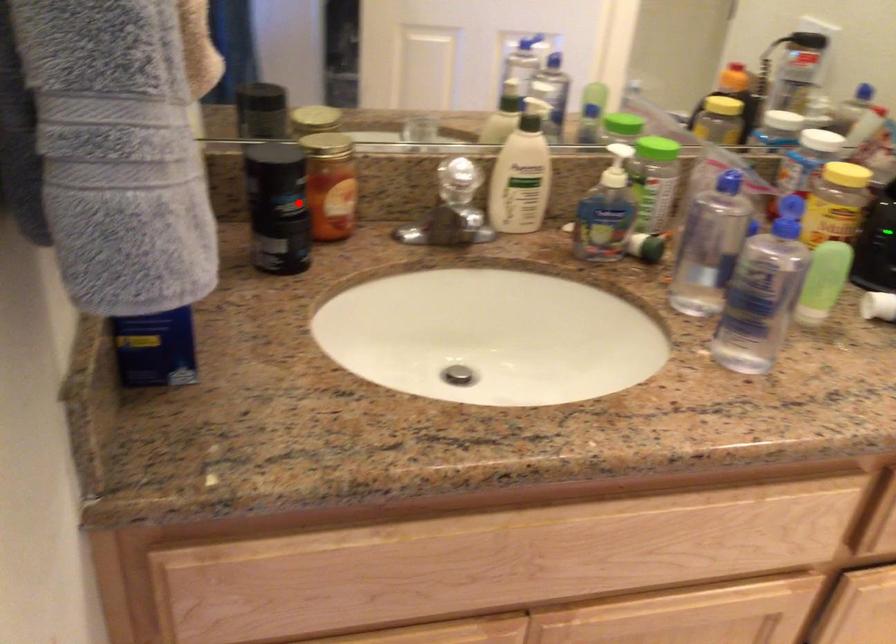
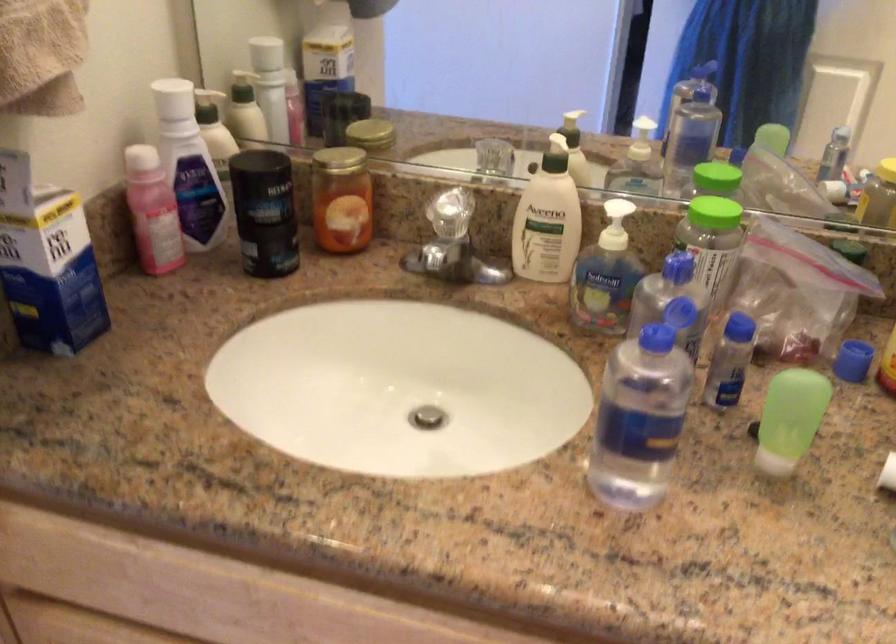
Where in the second image is the point corresponding to the highlighted location from the first image?

(264, 212)